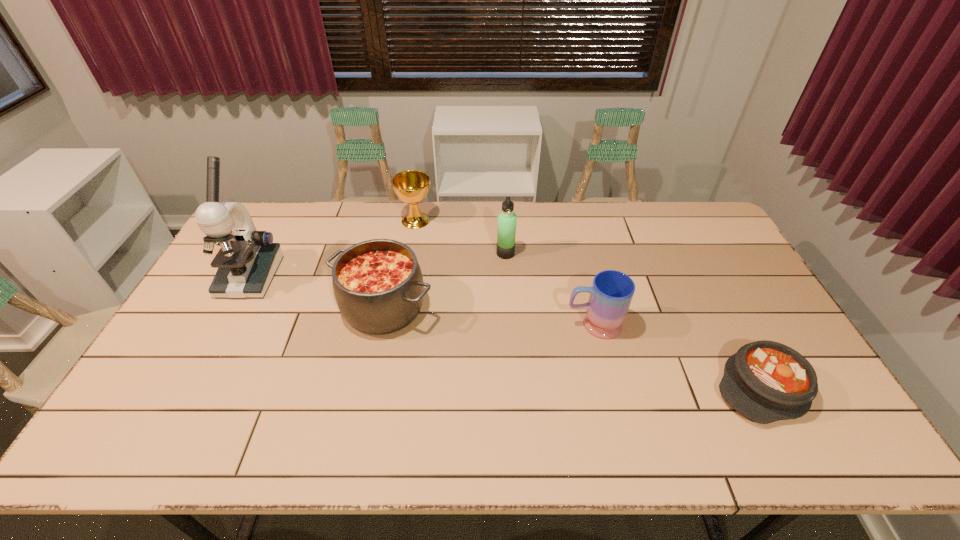
At what (x,y) coordinates should I click in order to perform the action: click on free space located 0.230m on the back of the microscope. Please return your answer as a coordinate pair (x, y). This screenshot has height=540, width=960. Looking at the image, I should click on (283, 215).

Find the location of a particular element. blank area located 0.170m on the right of the third object from right to left is located at coordinates (564, 253).

Identify the location of vacant area located 0.220m on the right of the chalice. (492, 220).

Identify the location of free location located 0.390m on the back of the farther casserole. (405, 208).

What are the coordinates of `vacant space located 0.290m on the side of the second object from right to left with the handle` in the screenshot? It's located at 465,325.

Find the location of a particular element. Image resolution: width=960 pixels, height=540 pixels. vacant region located 0.150m on the side of the second object from right to left with the handle is located at coordinates (513, 325).

Find the location of `vacant space located on the side of the second object from right to left with the handle`. vacant space located on the side of the second object from right to left with the handle is located at coordinates (434, 325).

Identify the location of vacant space located 0.250m on the back of the rightmost object. This screenshot has width=960, height=540. (710, 287).

This screenshot has width=960, height=540. Identify the location of object at the far edge. (411, 186).

The width and height of the screenshot is (960, 540). In order to click on object positioned at the near edge in this screenshot , I will do `click(765, 381)`.